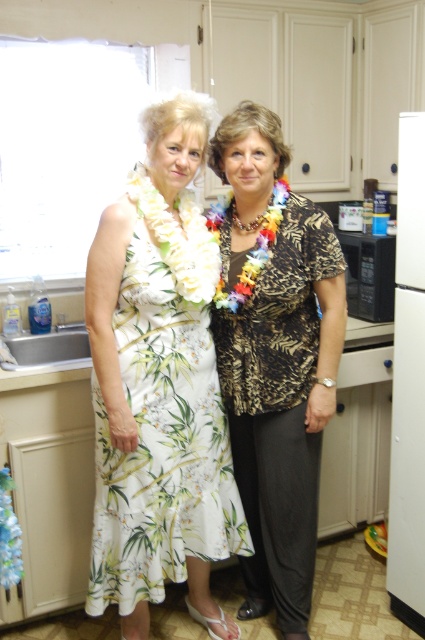
Question: Does printed fabric blouse at center appear under white floral dress at center?

Choices:
 (A) yes
 (B) no

Answer: (A)

Question: Which object appears closest to the camera in this image?

Choices:
 (A) white floral dress at center
 (B) printed fabric blouse at center

Answer: (A)

Question: Which point is closer to the camera?

Choices:
 (A) (235, 150)
 (B) (139, 522)

Answer: (B)

Question: Can you confirm if printed fabric blouse at center is wider than white floral dress at center?

Choices:
 (A) yes
 (B) no

Answer: (B)

Question: Does printed fabric blouse at center appear on the right side of white floral dress at center?

Choices:
 (A) yes
 (B) no

Answer: (A)